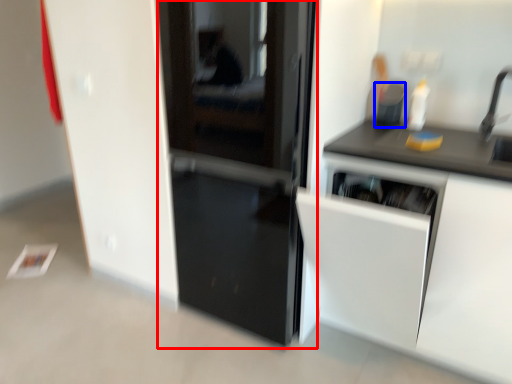
Question: Which point is closer to the camera, door (highlighted by a red box) or appliance (highlighted by a blue box)?

Choices:
 (A) door
 (B) appliance

Answer: (A)